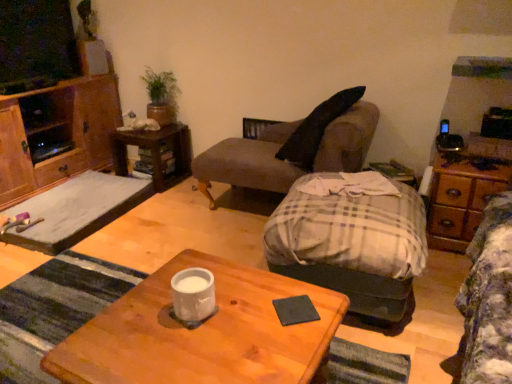
Locate an element on the screen. The height and width of the screenshot is (384, 512). vacant region to the right of black matte coaster at center is located at coordinates (330, 307).